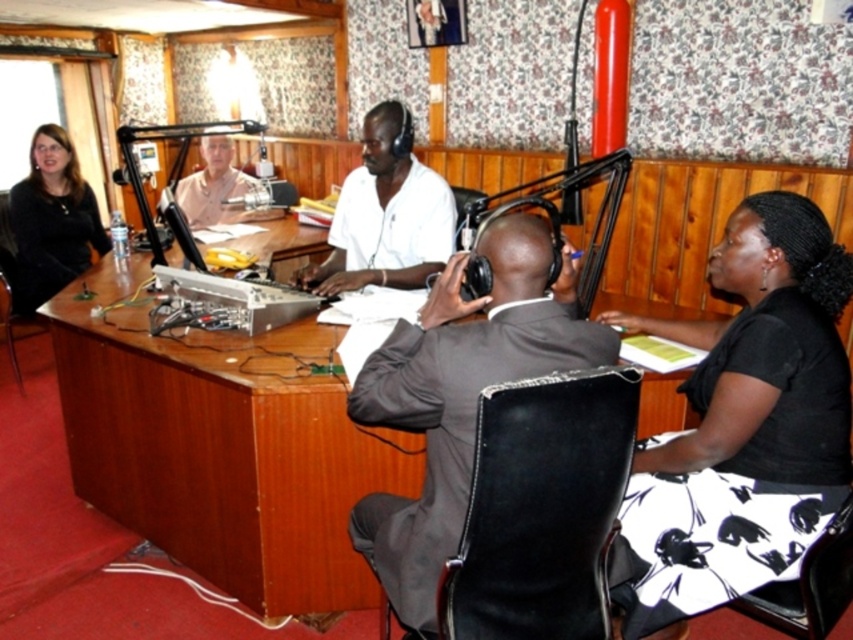
Question: Which of the following is the closest to the observer?

Choices:
 (A) white matte shirt at center
 (B) black printed skirt at lower right
 (C) dark gray suit at center
 (D) light brown wood desk at center

Answer: (C)

Question: Based on their relative distances, which object is nearer to the light brown wood desk at center?

Choices:
 (A) dark gray suit at center
 (B) matte black jacket at left

Answer: (B)

Question: Which object appears closest to the camera in this image?

Choices:
 (A) dark gray suit at center
 (B) white matte shirt at center
 (C) light brown wood desk at center
 (D) matte black jacket at left

Answer: (A)

Question: Can you confirm if black printed skirt at lower right is wider than matte black jacket at left?

Choices:
 (A) no
 (B) yes

Answer: (B)

Question: Does black printed skirt at lower right have a larger size compared to white matte shirt at center?

Choices:
 (A) no
 (B) yes

Answer: (B)

Question: From the image, what is the correct spatial relationship of dark gray suit at center in relation to light brown wood desk at center?

Choices:
 (A) right
 (B) left

Answer: (A)